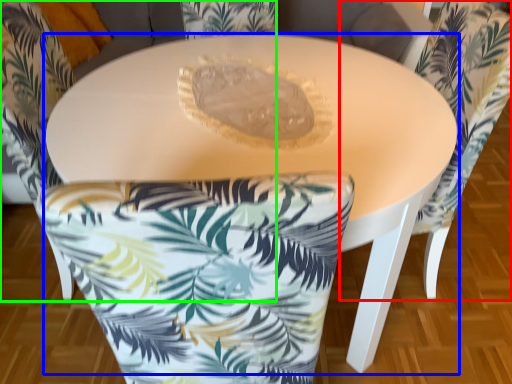
Question: Which object is the farthest from chair (highlighted by a red box)? Choose among these: table (highlighted by a blue box) or chair (highlighted by a green box).

Choices:
 (A) table
 (B) chair

Answer: (B)